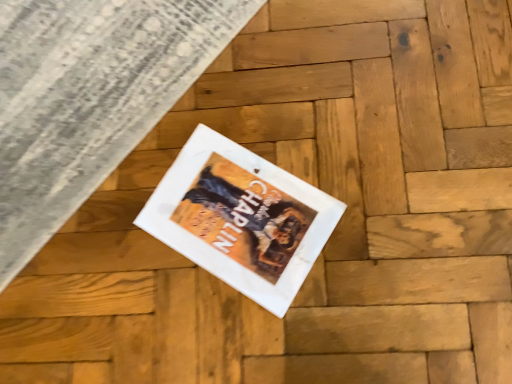
The height and width of the screenshot is (384, 512). I want to click on free space behind white matte picture frame at center, so click(x=187, y=98).